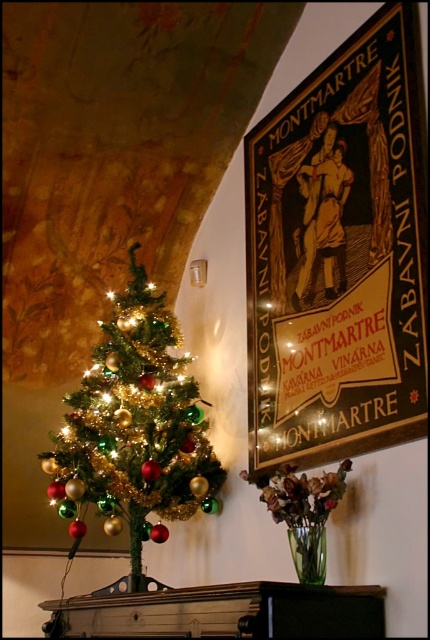
You are a visitor at this festive location and want to take a photo that includes both the black glossy signboard at upper right and the shiny metallic christmas tree at left. Which object should you position closer to the camera to ensure both are in focus?

The black glossy signboard at upper right is much taller than the shiny metallic christmas tree at left, so you should position the camera closer to the shiny metallic christmas tree at left to ensure both are in focus.

You are a guest at a holiday party and want to take a photo of both the black glossy signboard at upper right and the shiny metallic christmas tree at left. Which object should you position closer to the camera to ensure both are fully visible in the frame?

The black glossy signboard at upper right is to the right of the shiny metallic christmas tree at left. To ensure both are fully visible in the frame, you should position the shiny metallic christmas tree at left closer to the camera since it is farther away from the signboard, allowing both to fit within the photo.